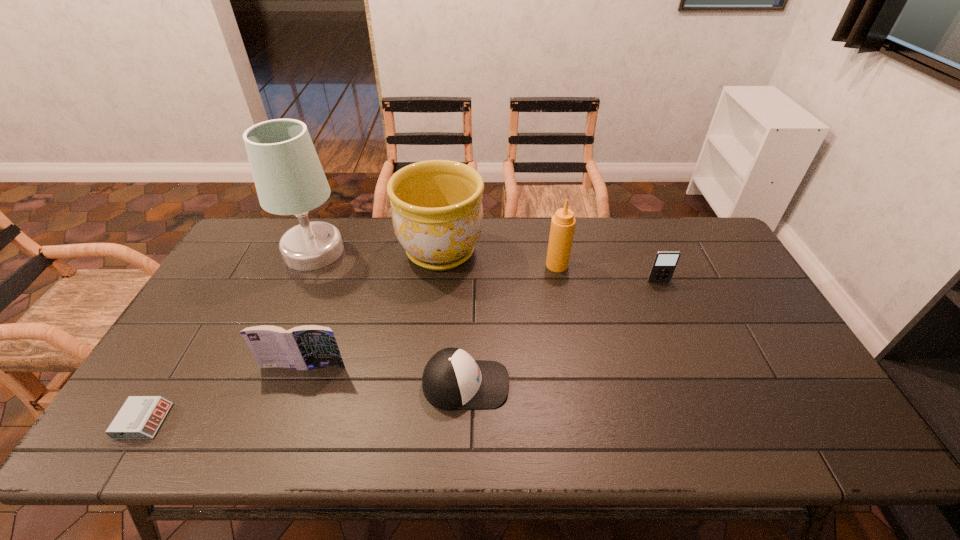
Identify the location of vacant area located 0.340m on the front of the condiment. The width and height of the screenshot is (960, 540). (575, 360).

Identify the location of free region located on the front cover of the fourth tallest object. The image size is (960, 540). (278, 437).

Identify the location of free space located 0.110m on the front-facing side of the rightmost object. The image size is (960, 540). (670, 308).

Locate an element on the screen. This screenshot has width=960, height=540. free location located on the front panel of the cap is located at coordinates click(x=601, y=384).

Locate an element on the screen. This screenshot has height=540, width=960. vacant region located 0.210m on the back of the shortest object is located at coordinates (196, 336).

Image resolution: width=960 pixels, height=540 pixels. I want to click on lampshade located in the far edge section of the desktop, so click(x=289, y=179).

At what (x,y) coordinates should I click in order to perform the action: click on flowerpot located in the far edge section of the desktop. Please return your answer as a coordinate pair (x, y). This screenshot has height=540, width=960. Looking at the image, I should click on (437, 214).

Image resolution: width=960 pixels, height=540 pixels. What are the coordinates of `condiment present at the far edge` in the screenshot? It's located at (563, 222).

This screenshot has height=540, width=960. I want to click on object located in the near edge section of the desktop, so click(x=140, y=417).

The height and width of the screenshot is (540, 960). Find the location of `object that is at the left edge`. object that is at the left edge is located at coordinates (140, 417).